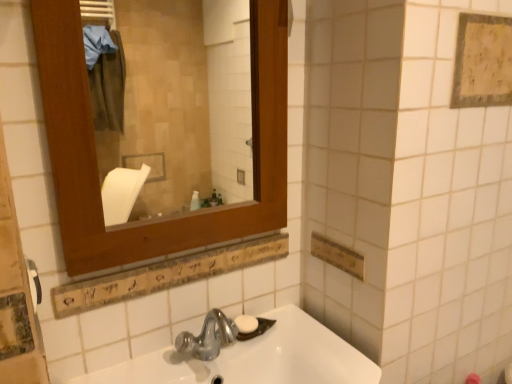
I want to click on white plastic towel bar at left, so click(x=34, y=283).

The height and width of the screenshot is (384, 512). Identify the location of white matte soap at center. (246, 324).

The image size is (512, 384). I want to click on white glossy sink at lower center, so click(255, 359).

At what (x,y) coordinates should I click in order to perform the action: click on white plastic towel bar at left. Please return your answer as a coordinate pair (x, y). The image size is (512, 384). Looking at the image, I should click on (34, 283).

Between white plastic towel bar at left and yellowish textured fabric at upper right, which one has larger size?

Bigger between the two is yellowish textured fabric at upper right.

Is white plastic towel bar at left not inside yellowish textured fabric at upper right?

Absolutely, white plastic towel bar at left is external to yellowish textured fabric at upper right.

Between white plastic towel bar at left and yellowish textured fabric at upper right, which one has less height?

Standing shorter between the two is white plastic towel bar at left.

Visually, is white plastic towel bar at left positioned to the left or to the right of yellowish textured fabric at upper right?

From the image, it's evident that white plastic towel bar at left is to the left of yellowish textured fabric at upper right.

I want to click on soap below the white plastic towel bar at left (from a real-world perspective), so click(246, 324).

In the scene shown: From a real-world perspective, is white plastic towel bar at left positioned over white matte soap at center based on gravity?

Indeed, from a real-world perspective, white plastic towel bar at left stands above white matte soap at center.

Is white plastic towel bar at left to the left of white matte soap at center from the viewer's perspective?

Correct, you'll find white plastic towel bar at left to the left of white matte soap at center.

In the scene shown: Is white matte soap at center not close to wooden frame at upper left?

Yes, white matte soap at center and wooden frame at upper left are located far from each other.

Is white matte soap at center bigger or smaller than wooden frame at upper left?

white matte soap at center is smaller than wooden frame at upper left.

Considering the relative sizes of white matte soap at center and wooden frame at upper left in the image provided, is white matte soap at center shorter than wooden frame at upper left?

Yes, white matte soap at center is shorter than wooden frame at upper left.

Is white matte soap at center aimed at wooden frame at upper left?

No, white matte soap at center is not turned towards wooden frame at upper left.

Measure the distance between wooden frame at upper left and yellowish textured fabric at upper right.

A distance of 2.13 meters exists between wooden frame at upper left and yellowish textured fabric at upper right.

Is point (130, 123) closer or farther from the camera than point (461, 69)?

Point (130, 123) appears to be farther away from the viewer than point (461, 69).

Are wooden frame at upper left and yellowish textured fabric at upper right far apart?

Yes, wooden frame at upper left is far from yellowish textured fabric at upper right.

Considering the positions of objects wooden frame at upper left and yellowish textured fabric at upper right in the image provided, who is more to the left, wooden frame at upper left or yellowish textured fabric at upper right?

Positioned to the left is wooden frame at upper left.

Looking at the image, does yellowish textured fabric at upper right seem bigger or smaller compared to wooden frame at upper left?

yellowish textured fabric at upper right is smaller than wooden frame at upper left.

Based on the photo, are yellowish textured fabric at upper right and wooden frame at upper left located far from each other?

yellowish textured fabric at upper right is positioned a significant distance from wooden frame at upper left.

From a real-world perspective, which object stands above the other?

yellowish textured fabric at upper right.

Who is more distant, yellowish textured fabric at upper right or wooden frame at upper left?

yellowish textured fabric at upper right is more distant.

Is white glossy sink at lower center positioned with its back to wooden frame at upper left?

No, white glossy sink at lower center's orientation is not away from wooden frame at upper left.

From a real-world perspective, who is located lower, white glossy sink at lower center or wooden frame at upper left?

white glossy sink at lower center, from a real-world perspective.

Considering the relative sizes of white glossy sink at lower center and wooden frame at upper left in the image provided, is white glossy sink at lower center smaller than wooden frame at upper left?

Actually, white glossy sink at lower center might be larger than wooden frame at upper left.

From the image's perspective, which is below, white plastic towel bar at left or wooden frame at upper left?

white plastic towel bar at left appears lower in the image.

Is white plastic towel bar at left positioned with its back to wooden frame at upper left?

No, white plastic towel bar at left is not facing away from wooden frame at upper left.

Is white plastic towel bar at left wider or thinner than wooden frame at upper left?

white plastic towel bar at left is thinner than wooden frame at upper left.

Is white plastic towel bar at left inside or outside of wooden frame at upper left?

white plastic towel bar at left is spatially situated outside wooden frame at upper left.

Find the location of a particular element. towel bar lying on the left of yellowish textured fabric at upper right is located at coordinates (34, 283).

Image resolution: width=512 pixels, height=384 pixels. I want to click on soap located underneath the white plastic towel bar at left (from a real-world perspective), so click(246, 324).

Based on their spatial positions, is white matte soap at center or white glossy sink at lower center further from yellowish textured fabric at upper right?

white matte soap at center is positioned further to the anchor yellowish textured fabric at upper right.

Consider the image. Which object lies nearer to the anchor point white matte soap at center, white glossy sink at lower center or yellowish textured fabric at upper right?

white glossy sink at lower center is closer to white matte soap at center.

Looking at the image, which one is located further to white plastic towel bar at left, white glossy sink at lower center or wooden frame at upper left?

Among the two, wooden frame at upper left is located further to white plastic towel bar at left.

Based on the photo, looking at the image, which one is located further to yellowish textured fabric at upper right, white glossy sink at lower center or white plastic towel bar at left?

Based on the image, white plastic towel bar at left appears to be further to yellowish textured fabric at upper right.

When comparing their distances from white glossy sink at lower center, does wooden frame at upper left or white plastic towel bar at left seem further?

wooden frame at upper left lies further to white glossy sink at lower center than the other object.

Considering their positions, is white plastic towel bar at left positioned further to white matte soap at center than yellowish textured fabric at upper right?

Among the two, yellowish textured fabric at upper right is located further to white matte soap at center.

When comparing their distances from wooden frame at upper left, does white glossy sink at lower center or white matte soap at center seem further?

white matte soap at center lies further to wooden frame at upper left than the other object.

Looking at the image, which one is located further to yellowish textured fabric at upper right, white glossy sink at lower center or wooden frame at upper left?

Among the two, wooden frame at upper left is located further to yellowish textured fabric at upper right.

The width and height of the screenshot is (512, 384). Find the location of `soap between wooden frame at upper left and white glossy sink at lower center in the vertical direction`. soap between wooden frame at upper left and white glossy sink at lower center in the vertical direction is located at coordinates (246, 324).

Image resolution: width=512 pixels, height=384 pixels. In order to click on towel bar that lies between wooden frame at upper left and white glossy sink at lower center from top to bottom in this screenshot , I will do `click(34, 283)`.

Where is `towel bar between white glossy sink at lower center and white matte soap at center along the z-axis`? Image resolution: width=512 pixels, height=384 pixels. towel bar between white glossy sink at lower center and white matte soap at center along the z-axis is located at coordinates (34, 283).

This screenshot has height=384, width=512. I want to click on mirror between white plastic towel bar at left and yellowish textured fabric at upper right, so click(170, 105).